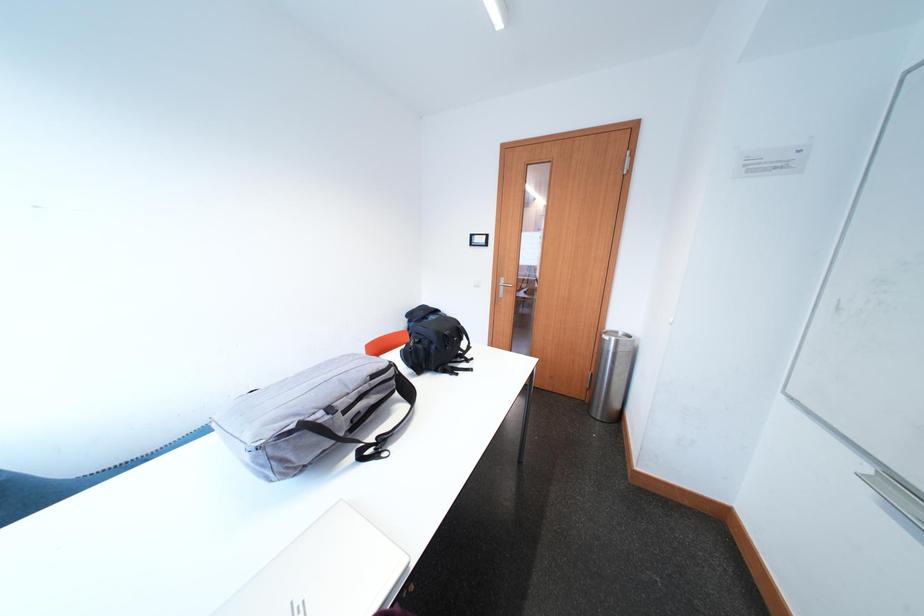
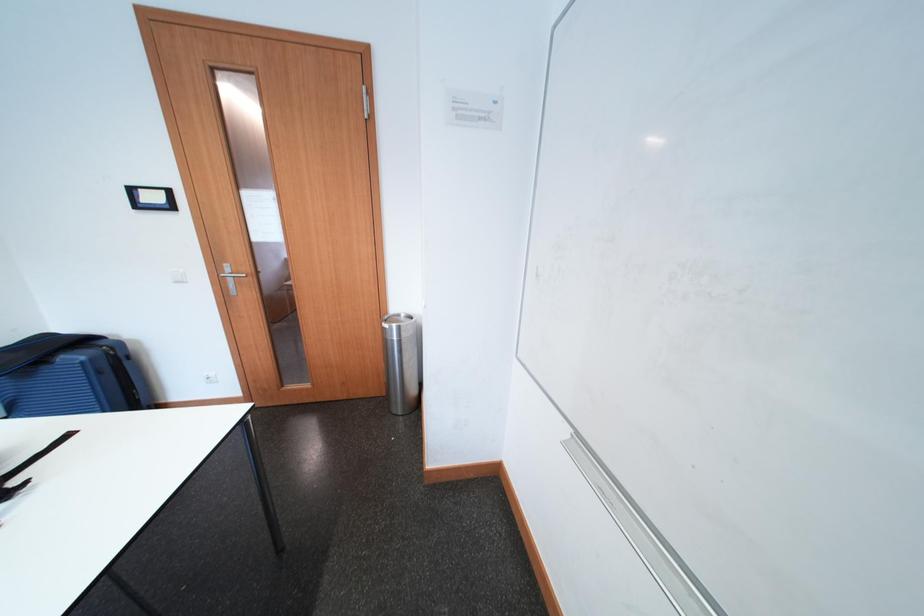
Question: The images are taken continuously from a first-person perspective. In which direction is your viewpoint rotating?

Choices:
 (A) Left
 (B) Right
 (C) Up
 (D) Down

Answer: (B)